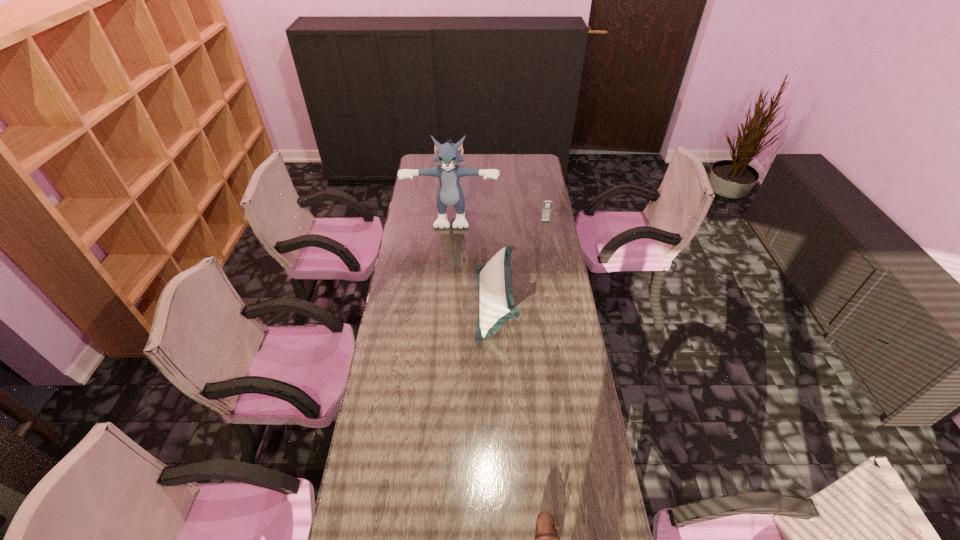
What are the coordinates of `free space between the tallest object and the third shortest object` in the screenshot? It's located at (474, 259).

In order to click on free space between the cat and the cushion in this screenshot , I will do click(474, 259).

Select which object is the third closest to the tallest object. Please provide its 2D coordinates. Your answer should be formatted as a tuple, i.e. [(x, y)], where the tuple contains the x and y coordinates of a point satisfying the conditions above.

[(546, 539)]

Where is `object that is the third nearest to the nearest object`? The height and width of the screenshot is (540, 960). object that is the third nearest to the nearest object is located at coordinates (547, 204).

Identify the location of vacant area that satisfies the following two spatial constraints: 1. on the front-facing side of the rightmost object; 2. on the surface of the cushion. (560, 303).

Where is `vacant region that satisfies the following two spatial constraints: 1. on the front-facing side of the rightmost object; 2. on the surface of the third farthest object`? The width and height of the screenshot is (960, 540). vacant region that satisfies the following two spatial constraints: 1. on the front-facing side of the rightmost object; 2. on the surface of the third farthest object is located at coordinates (560, 303).